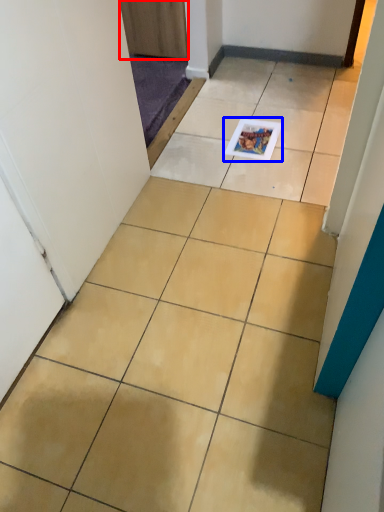
Question: Which point is further to the camera, door (highlighted by a red box) or magazine (highlighted by a blue box)?

Choices:
 (A) door
 (B) magazine

Answer: (A)